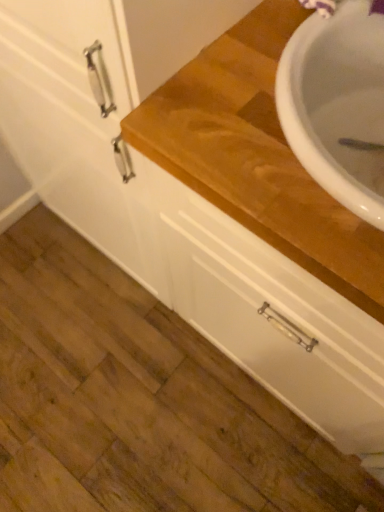
Question: From a real-world perspective, is white matte drawer at center positioned above or below wooden at upper right?

Choices:
 (A) above
 (B) below

Answer: (B)

Question: In terms of height, does white matte drawer at center look taller or shorter compared to wooden at upper right?

Choices:
 (A) short
 (B) tall

Answer: (A)

Question: Choose the correct answer: Is white matte drawer at center inside wooden at upper right or outside it?

Choices:
 (A) inside
 (B) outside

Answer: (B)

Question: Is point (241, 147) positioned closer to the camera than point (200, 320)?

Choices:
 (A) closer
 (B) farther

Answer: (A)

Question: Considering the positions of wooden at upper right and white matte drawer at center in the image, is wooden at upper right wider or thinner than white matte drawer at center?

Choices:
 (A) wide
 (B) thin

Answer: (B)

Question: From a real-world perspective, is wooden at upper right positioned above or below white matte drawer at center?

Choices:
 (A) above
 (B) below

Answer: (A)

Question: Relative to white matte drawer at center, is wooden at upper right in front or behind?

Choices:
 (A) front
 (B) behind

Answer: (A)